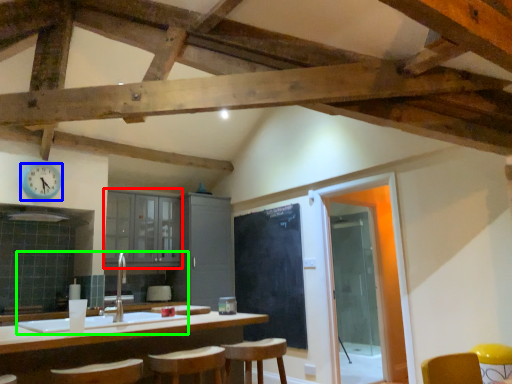
Question: Estimate the real-world distances between objects in this image. Which object is closer to cabinetry (highlighted by a red box), clock (highlighted by a blue box) or sink (highlighted by a green box)?

Choices:
 (A) clock
 (B) sink

Answer: (A)